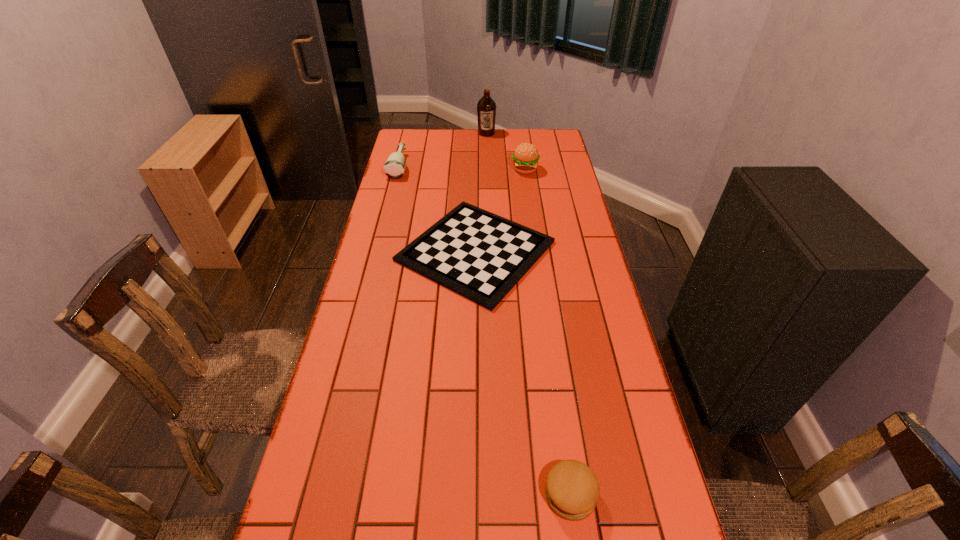
I want to click on vacant area between the second tallest object and the fourth farthest object, so click(x=500, y=210).

Identify the location of free area in between the farthest object and the shortest object. (481, 192).

At what (x,y) coordinates should I click in order to perform the action: click on free spot between the farthest object and the farther hamburger. Please return your answer as a coordinate pair (x, y). Looking at the image, I should click on (505, 151).

Choose which object is the fourth nearest neighbor to the bottle. Please provide its 2D coordinates. Your answer should be formatted as a tuple, i.e. [(x, y)], where the tuple contains the x and y coordinates of a point satisfying the conditions above.

[(572, 490)]

Find the location of a particular element. The height and width of the screenshot is (540, 960). object that stands as the second closest to the taller hamburger is located at coordinates coord(486,108).

You are a GUI agent. You are given a task and a screenshot of the screen. Output one action in this format:
    pyautogui.click(x=<x>, y=<y>)
    Task: Click on the free spot that satisfies the following two spatial constraints: 1. on the front side of the bottle; 2. on the left side of the second tallest object
    This screenshot has width=960, height=540.
    Given the screenshot: What is the action you would take?
    pyautogui.click(x=398, y=170)

Locate an element on the screen. vacant space that satisfies the following two spatial constraints: 1. on the front side of the leftmost object; 2. on the left side of the farther hamburger is located at coordinates (398, 170).

Where is `free region that satisfies the following two spatial constraints: 1. on the front side of the fourth tallest object; 2. on the left side of the bottle`? free region that satisfies the following two spatial constraints: 1. on the front side of the fourth tallest object; 2. on the left side of the bottle is located at coordinates (315, 495).